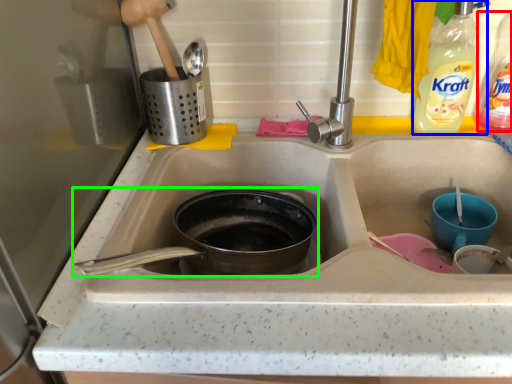
Question: Which object is positioned farthest from bottle (highlighted by a red box)? Select from bottle (highlighted by a blue box) and frying pan (highlighted by a green box).

Choices:
 (A) bottle
 (B) frying pan

Answer: (B)